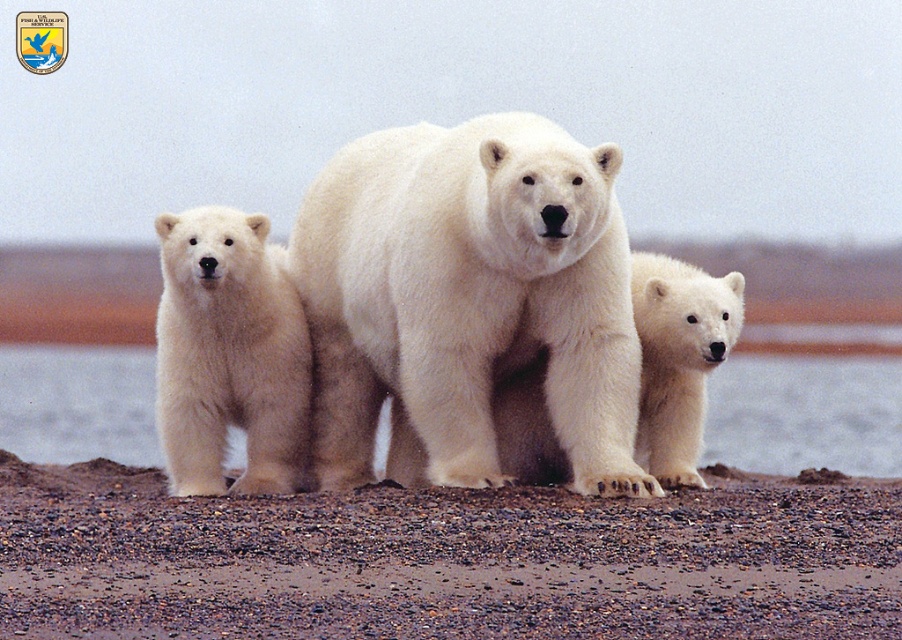
You are a photographer trying to capture the white fluffy bear at left and the brown gravel at center in a single frame. Based on their widths, which one should you focus on to ensure both fit in the photo?

The brown gravel at center might be wider than the white fluffy bear at left, so focusing on the wider brown gravel at center would help ensure both fit into the frame.

You are a photographer trying to capture a photo of the white fluffy bear at left and the brown gravel at center. From your current position, which object is located to the left of the other?

The white fluffy bear at left is positioned to the left of the brown gravel at center.